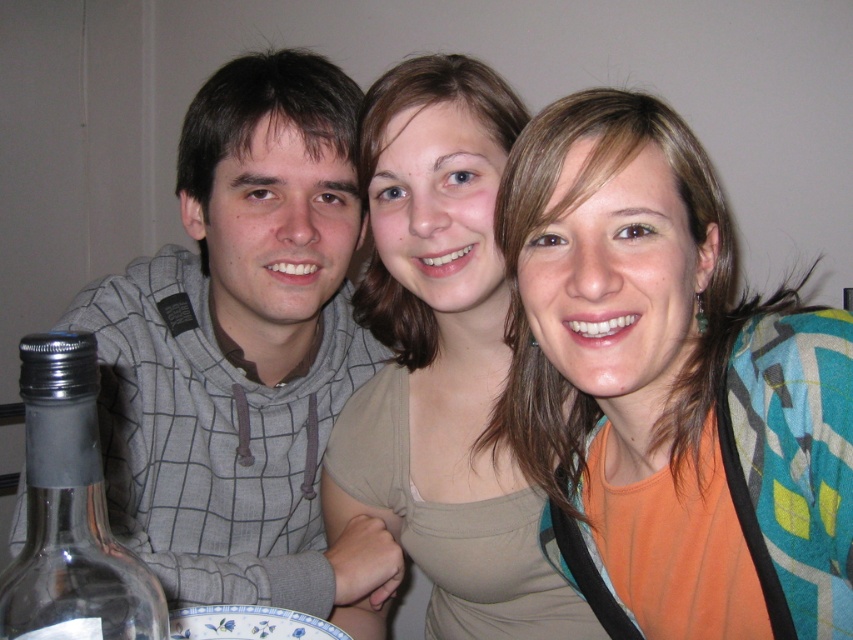
You are a photographer setting up a shoot. You have a matte beige tank top at center and a blue and white ceramic plate at lower center in your scene. You need to ensure that the tank top is wider than the plate for the composition. Based on the scene description, does the current arrangement meet your requirement?

Yes, the current arrangement meets the requirement because the matte beige tank top at center is wider than the blue and white ceramic plate at lower center according to the description.

Looking at the scene described, which object is positioned to the right of the other between the matte beige tank top at center and the blue and white ceramic plate at lower center?

The matte beige tank top at center is positioned to the right of the blue and white ceramic plate at lower center.

You are a photographer setting up a shot and want to ensure the orange fabric at center and the gray checkered hoodie at left are both visible. Based on their positions, which object is lower in the frame?

The orange fabric at center is below gray checkered hoodie at left, so the orange fabric at center is lower in the frame.